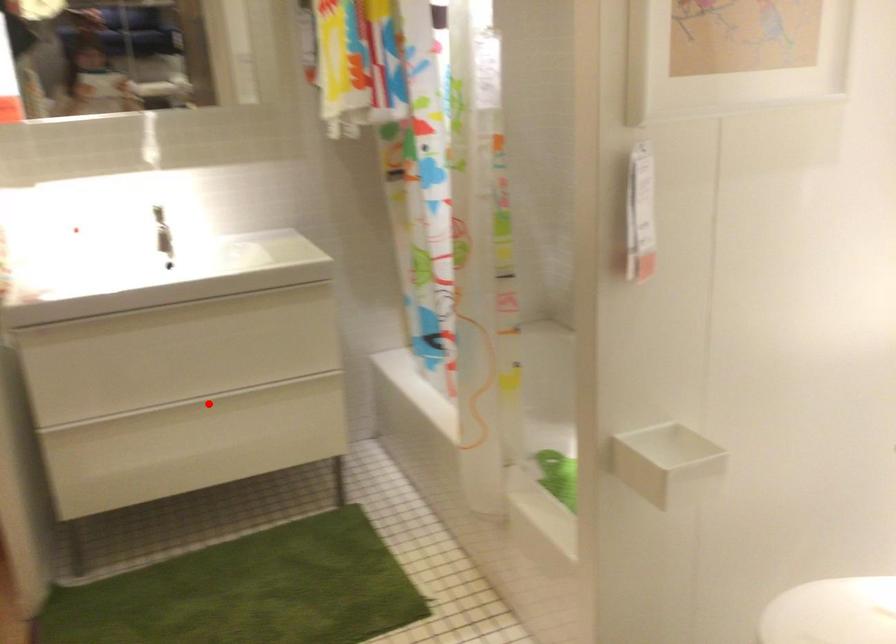
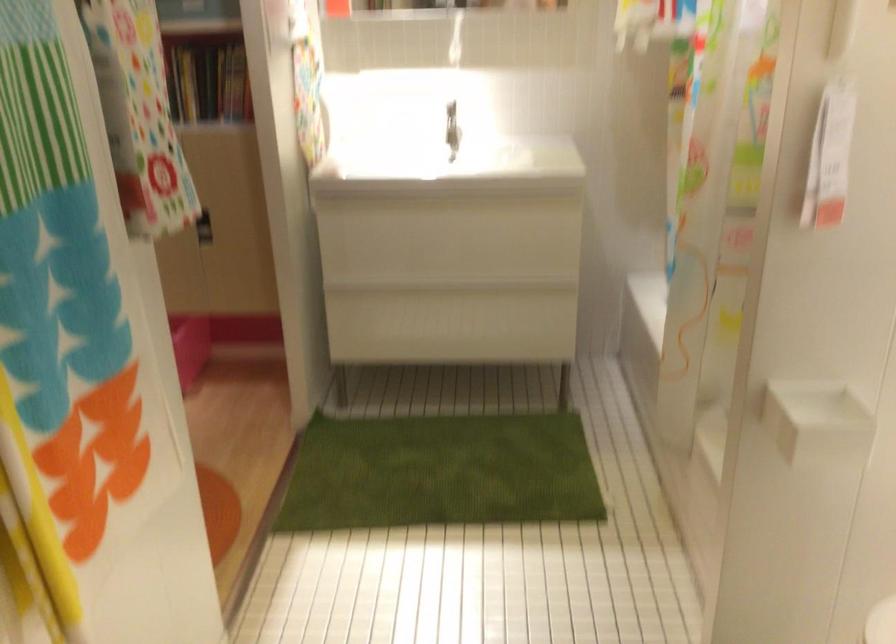
Question: A red point is marked in image1. In image2, is the corresponding 3D point closer to the camera or farther? Reply with the corresponding letter.

Choices:
 (A) The corresponding 3D point is closer.
 (B) The corresponding 3D point is farther.

Answer: (B)